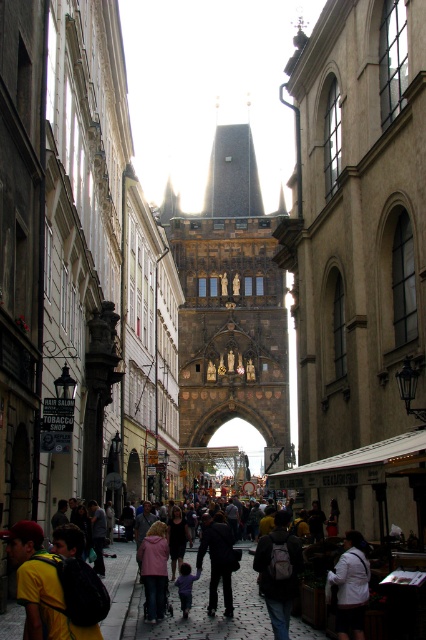
You are standing at the starting point of the Charles Bridge and want to reach a specific location. There are two points marked on your map as point 1 at coordinates point [279,556] and point 2 at coordinates point [201,538]. According to the image, which point is closer to you as you face the bridge?

Point [279,556] is in front of point [201,538], so point [279,556] is closer to you as you face the bridge.

You are standing on the Charles Bridge and want to take a photo of both the point at coordinates (259, 321) and the point at coordinates (336, 604). Which point should you focus on first to ensure both are in the frame?

You should focus on the point at coordinates (259, 321) first because it is closer to you than the point at coordinates (336, 604), ensuring both are in the frame.

You are a tourist standing on the Charles Bridge in Prague and looking towards the street. You see a pink fabric jacket at center and a purple fabric at center. Which item is positioned higher relative to the other?

The pink fabric jacket at center is located above the purple fabric at center, so it is positioned higher.